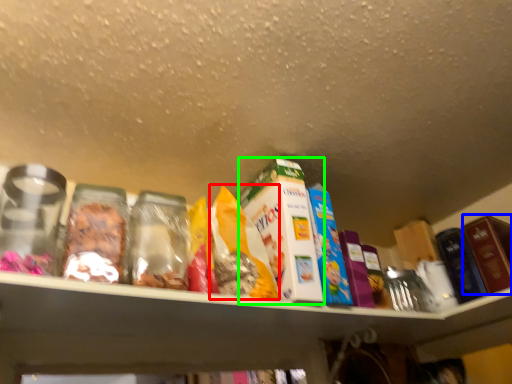
Question: Estimate the real-world distances between objects in this image. Which object is farther from cereal (highlighted by a red box), product (highlighted by a blue box) or product (highlighted by a green box)?

Choices:
 (A) product
 (B) product

Answer: (A)